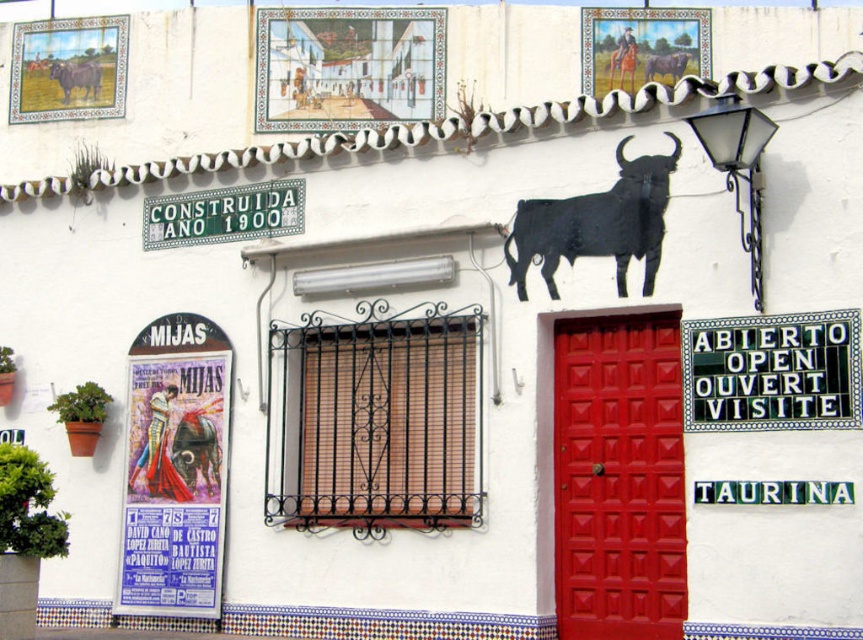
Question: Can you confirm if glossy wood door at center right is smaller than black metal streetlamp at upper right?

Choices:
 (A) no
 (B) yes

Answer: (B)

Question: Is glossy wood door at center right positioned at the back of black matte bull at center?

Choices:
 (A) yes
 (B) no

Answer: (B)

Question: Which is farther from the black tile sign at upper right?

Choices:
 (A) greenmattesign at upper center
 (B) matte black bull at upper left

Answer: (B)

Question: In this image, where is glossy wood door at center right located relative to brown leather horse at upper center?

Choices:
 (A) below
 (B) above

Answer: (A)

Question: Which of the following is the farthest from the observer?

Choices:
 (A) greenmattesign at upper center
 (B) matte paper poster at left

Answer: (A)

Question: Which point is closer to the camera?

Choices:
 (A) black tile sign at upper right
 (B) greenmattesign at upper center
 (C) matte black bull at upper left
 (D) black metal streetlamp at upper right

Answer: (D)